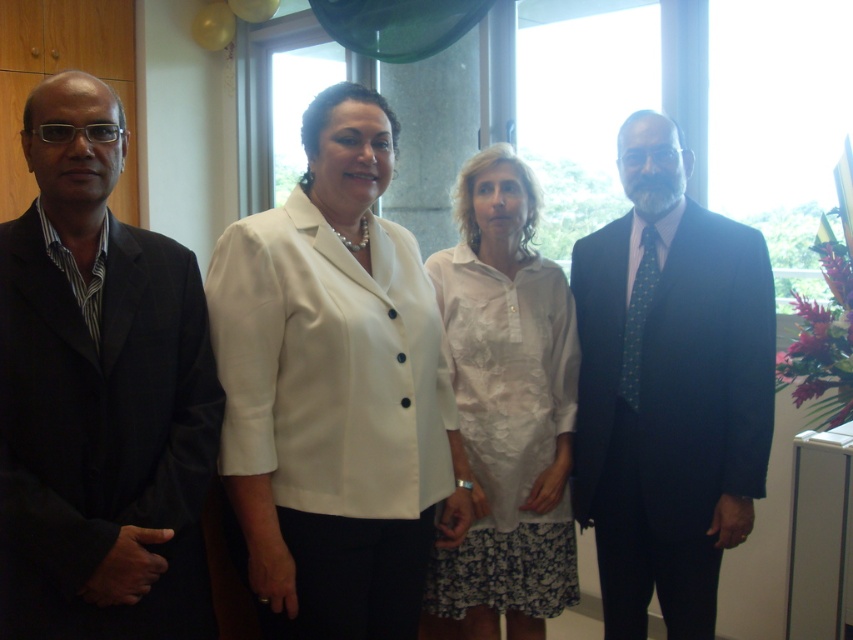
Is dark blue suit at center to the right of white cotton shirt at center from the viewer's perspective?

Yes, dark blue suit at center is to the right of white cotton shirt at center.

Based on the photo, does dark blue suit at center have a smaller size compared to white cotton shirt at center?

Actually, dark blue suit at center might be larger than white cotton shirt at center.

Which is behind, point (599, 396) or point (473, 525)?

The point (473, 525) is behind.

Where is `dark blue suit at center`? The image size is (853, 640). dark blue suit at center is located at coordinates (668, 388).

Does white matte blazer at center have a greater width compared to dark blue suit at center?

Correct, the width of white matte blazer at center exceeds that of dark blue suit at center.

The height and width of the screenshot is (640, 853). In order to click on white matte blazer at center in this screenshot , I will do `click(334, 390)`.

What do you see at coordinates (334, 390) in the screenshot? Image resolution: width=853 pixels, height=640 pixels. I see `white matte blazer at center` at bounding box center [334, 390].

This screenshot has height=640, width=853. In order to click on white matte blazer at center in this screenshot , I will do `click(334, 390)`.

Is point (73, 212) less distant than point (642, 205)?

Yes, it is in front of point (642, 205).

Find the location of `black matte suit at left`. black matte suit at left is located at coordinates (99, 394).